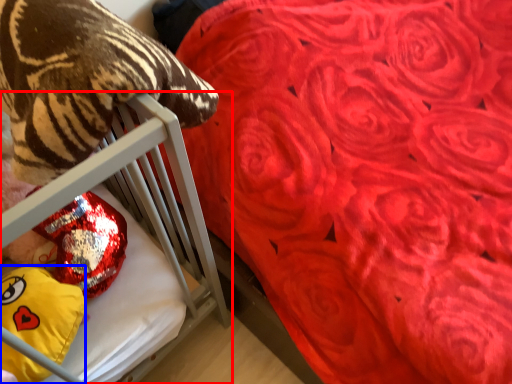
Question: Which point is further to the camera, furniture (highlighted by a red box) or throw pillow (highlighted by a blue box)?

Choices:
 (A) furniture
 (B) throw pillow

Answer: (A)